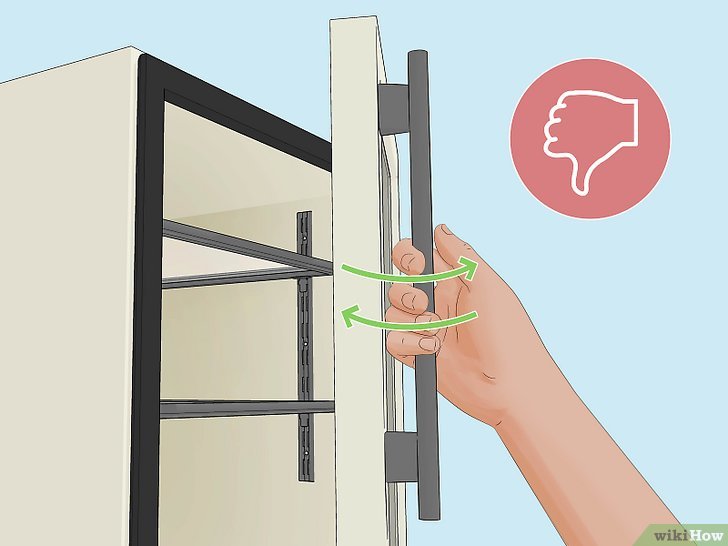
Identify the location of shelf. (215, 263).